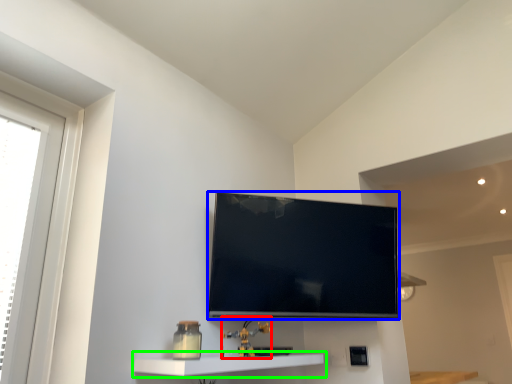
Question: Which is farther away from toy (highlighted by a red box)? television (highlighted by a blue box) or shelf (highlighted by a green box)?

Choices:
 (A) television
 (B) shelf

Answer: (A)